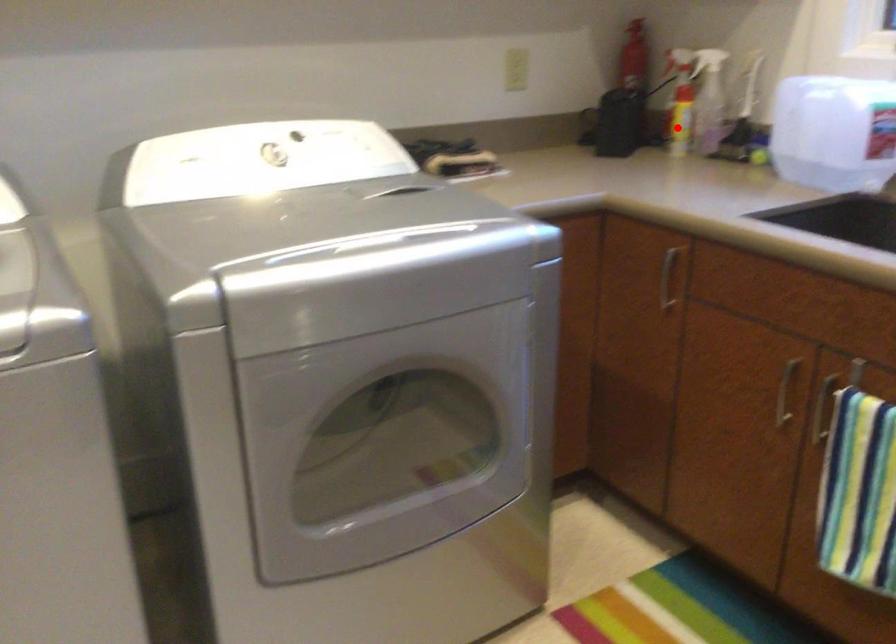
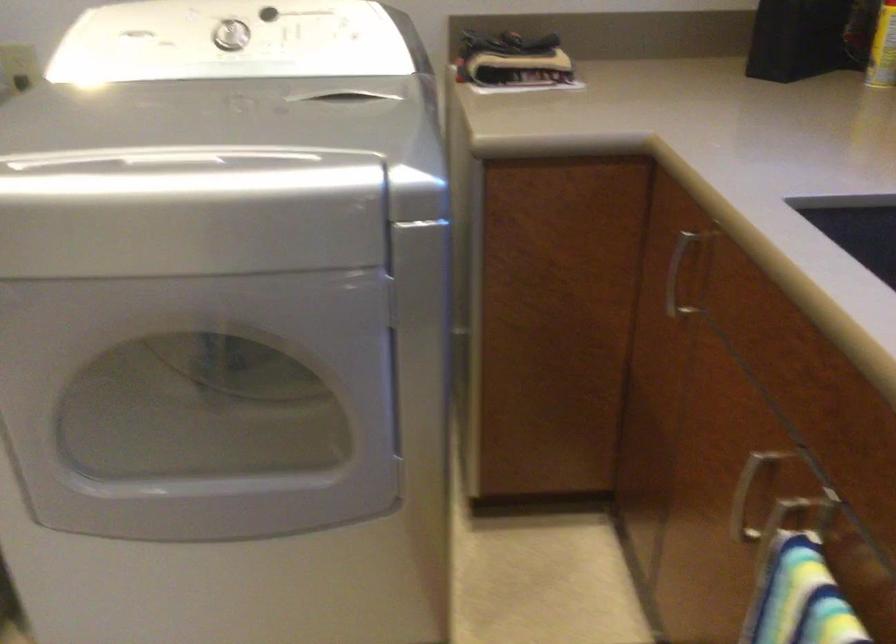
Question: I am providing you with two images of the same scene from different viewpoints. A red point is shown in image1. For the corresponding object point in image2, is it positioned nearer or farther from the camera?

Choices:
 (A) Nearer
 (B) Farther

Answer: (A)